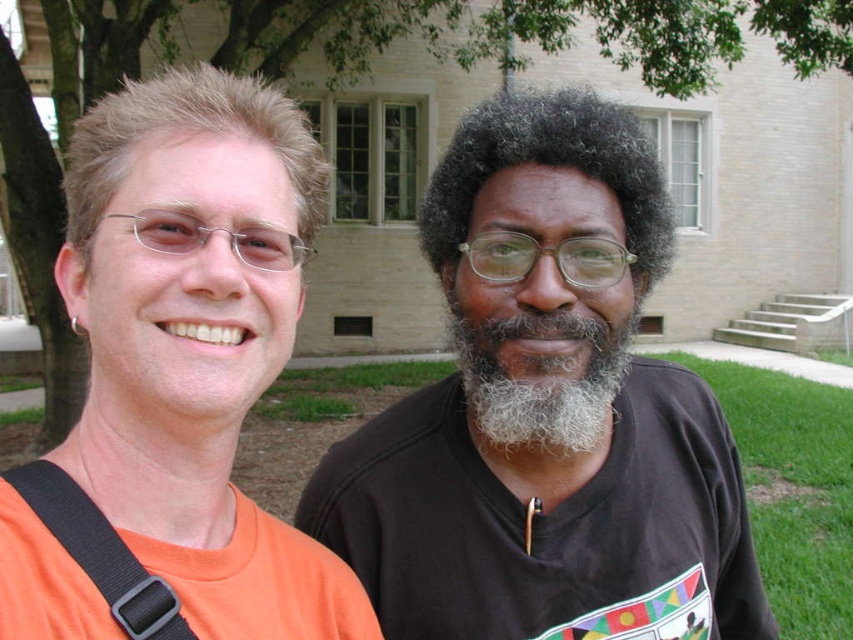
Question: Which object is closer to the camera taking this photo?

Choices:
 (A) gray fuzzy beard at center
 (B) black matte shirt at center
 (C) orange matte t-shirt at left

Answer: (C)

Question: Which object is the farthest from the orange matte t-shirt at left?

Choices:
 (A) black matte shirt at center
 (B) gray fuzzy beard at center

Answer: (A)

Question: In this image, where is black matte shirt at center located relative to orange matte t-shirt at left?

Choices:
 (A) right
 (B) left

Answer: (A)

Question: Which of the following is the closest to the observer?

Choices:
 (A) gray fuzzy beard at center
 (B) black matte shirt at center
 (C) orange matte t-shirt at left

Answer: (C)

Question: Can you confirm if orange matte t-shirt at left is smaller than gray fuzzy beard at center?

Choices:
 (A) no
 (B) yes

Answer: (A)

Question: Is black matte shirt at center wider than orange matte t-shirt at left?

Choices:
 (A) yes
 (B) no

Answer: (A)